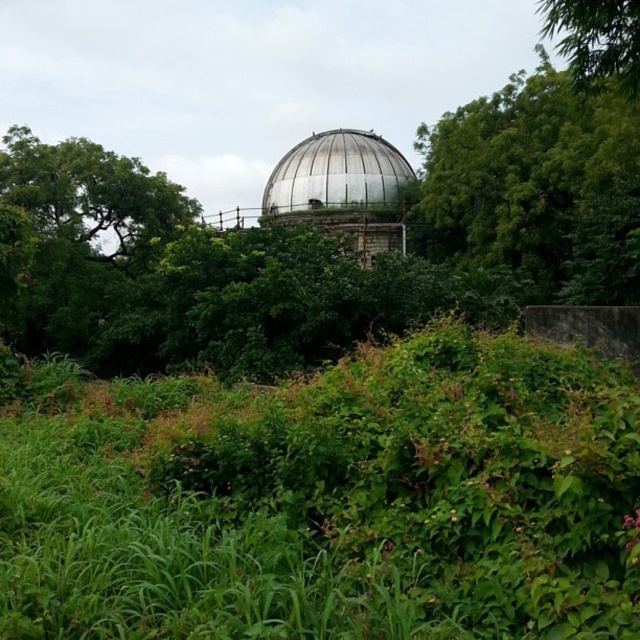
Question: Can you confirm if green leafy tree at upper center is positioned below green leafy tree at upper right?

Choices:
 (A) no
 (B) yes

Answer: (B)

Question: Which point is farther to the camera?

Choices:
 (A) (516, 500)
 (B) (365, 156)

Answer: (B)

Question: Among these points, which one is farthest from the camera?

Choices:
 (A) (620, 67)
 (B) (380, 390)

Answer: (A)

Question: Where is green leafy tree at upper center located in relation to shiny metallic dome at center in the image?

Choices:
 (A) above
 (B) below

Answer: (B)

Question: Observing the image, what is the correct spatial positioning of green leafy grass at center in reference to shiny metallic dome at center?

Choices:
 (A) above
 (B) below

Answer: (B)

Question: Which of the following is the farthest from the observer?

Choices:
 (A) (480, 209)
 (B) (547, 35)
 (C) (326, 209)

Answer: (B)